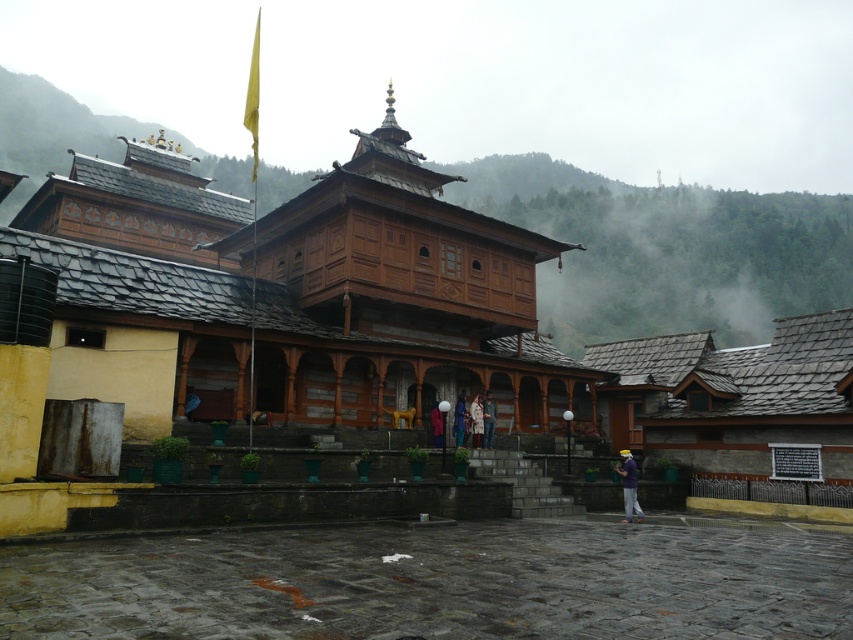
Question: Which of the following is the farthest from the observer?

Choices:
 (A) (637, 508)
 (B) (200, 177)
 (C) (490, 410)

Answer: (B)

Question: Is light brown fabric jacket at center bigger than blue fabric person at center?

Choices:
 (A) no
 (B) yes

Answer: (B)

Question: Which point is farther to the camera?

Choices:
 (A) (456, 432)
 (B) (634, 465)
 (C) (438, 433)
 (D) (480, 435)

Answer: (D)

Question: Is purple cotton shirt at lower right to the left of light brown wooden statue at center from the viewer's perspective?

Choices:
 (A) no
 (B) yes

Answer: (A)

Question: Is light brown fabric jacket at center further to camera compared to light brown wooden statue at center?

Choices:
 (A) no
 (B) yes

Answer: (B)

Question: Considering the real-world distances, which object is farthest from the purple cotton shirt at lower right?

Choices:
 (A) light brown wooden statue at center
 (B) wooden temple at center
 (C) white fabric coat at center

Answer: (B)